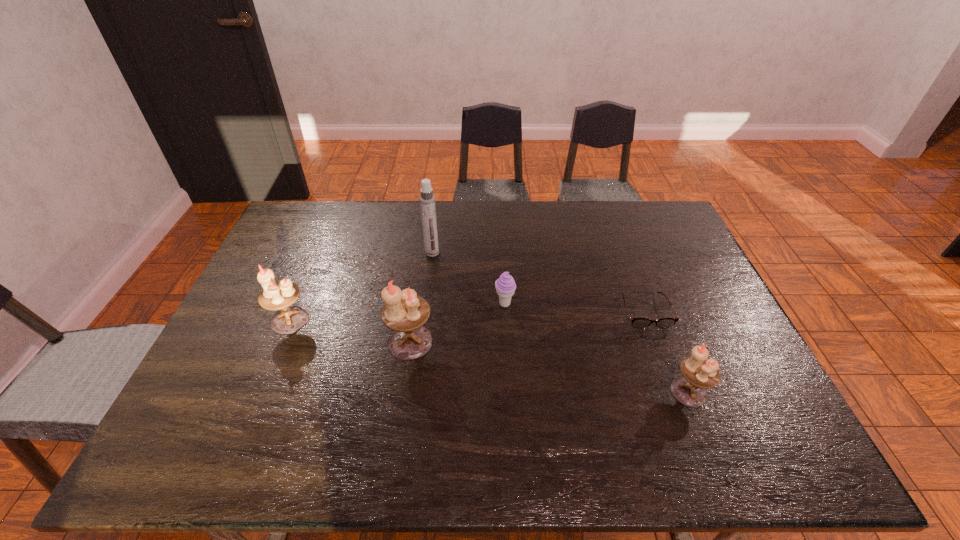
Locate an element on the screen. vacant area situated 0.180m on the right of the second candle holder from left to right is located at coordinates (500, 342).

This screenshot has height=540, width=960. Identify the location of blank space located 0.380m on the left of the nearest object. (516, 392).

This screenshot has height=540, width=960. Find the location of `blank area located 0.110m on the face of the shortest object`. blank area located 0.110m on the face of the shortest object is located at coordinates (663, 362).

Image resolution: width=960 pixels, height=540 pixels. Find the location of `vacant space positioned 0.310m on the front of the aerosol can`. vacant space positioned 0.310m on the front of the aerosol can is located at coordinates (423, 329).

Find the location of a particular element. Image resolution: width=960 pixels, height=540 pixels. vacant space located on the right of the fifth tallest object is located at coordinates click(x=637, y=304).

Locate an element on the screen. The height and width of the screenshot is (540, 960). object situated at the near edge is located at coordinates (699, 373).

At what (x,y) coordinates should I click in order to perform the action: click on object located at the left edge. Please return your answer as a coordinate pair (x, y). Image resolution: width=960 pixels, height=540 pixels. Looking at the image, I should click on [280, 295].

Identify the location of candle holder that is at the right edge. The image size is (960, 540). (699, 373).

Where is `spectacles at the right edge`? The width and height of the screenshot is (960, 540). spectacles at the right edge is located at coordinates (637, 323).

Identify the location of object that is at the near right corner. (699, 373).